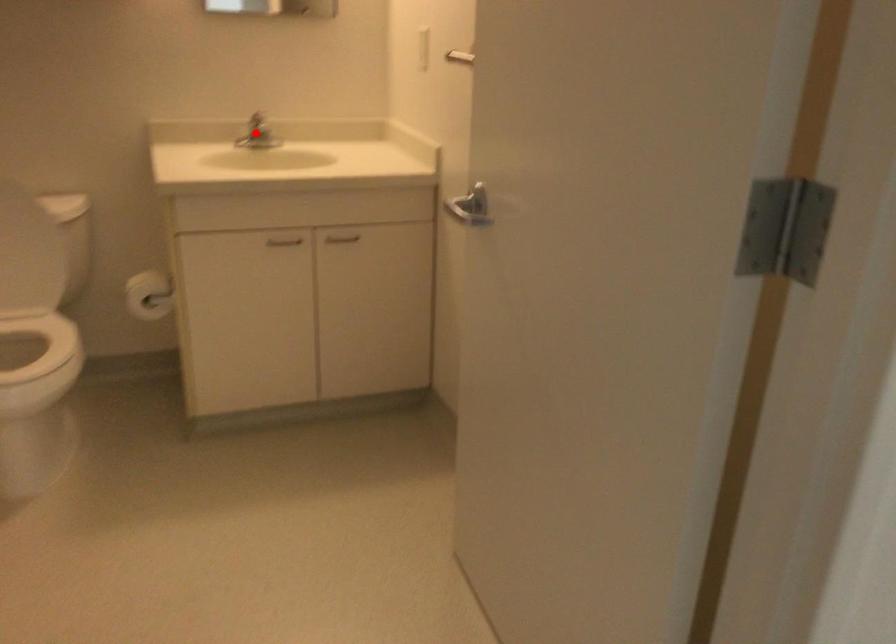
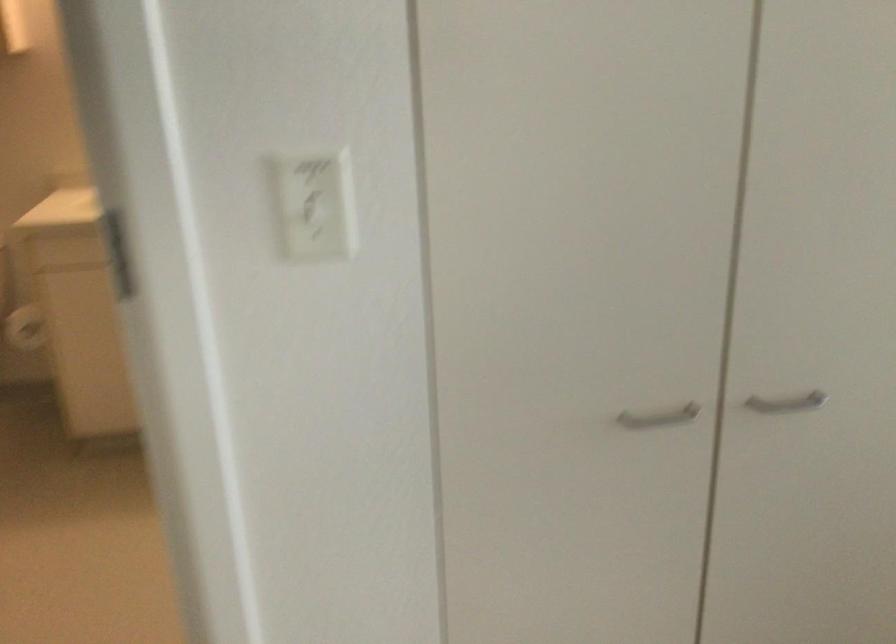
Question: I am providing you with two images of the same scene from different viewpoints. A red point is marked on the first image. At the location where the point appears in image 1, is it still visible in image 2?

Choices:
 (A) Yes
 (B) No

Answer: (B)